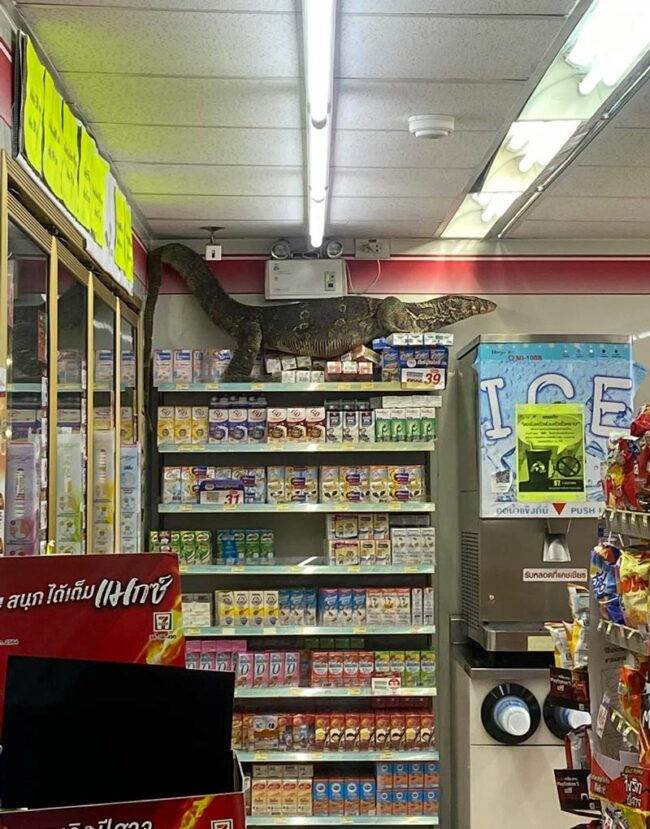
I want to click on scales, so click(x=327, y=313).